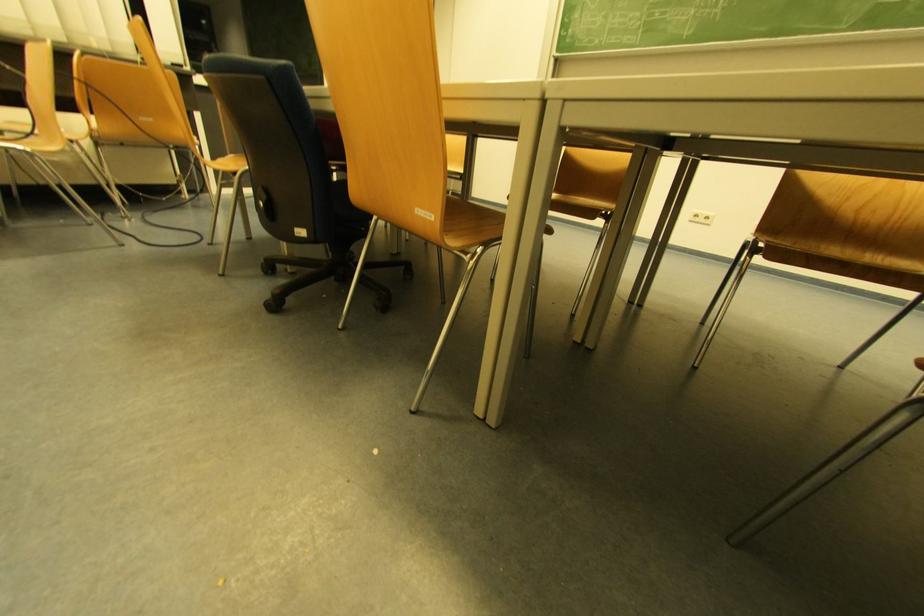
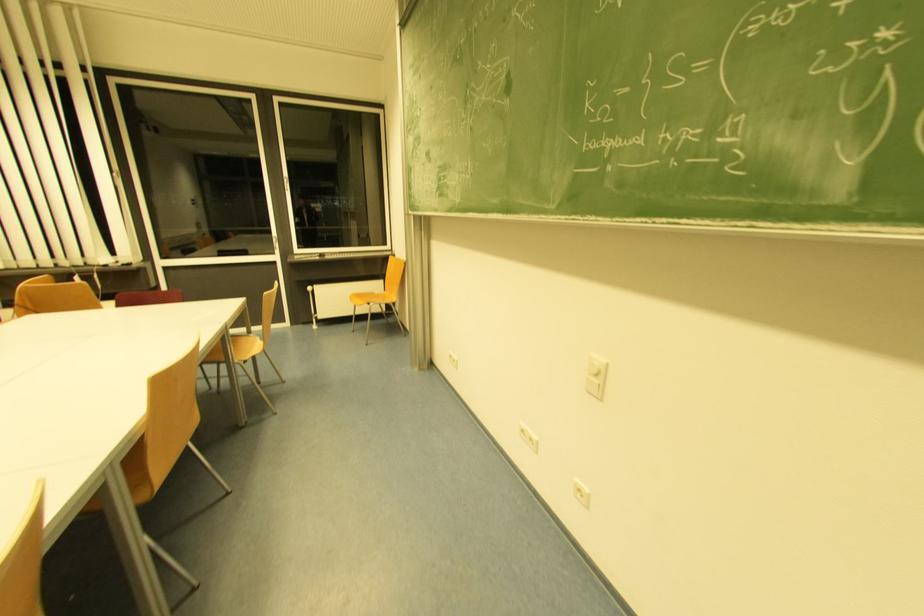
The images are taken continuously from a first-person perspective. In which direction are you moving?

The movement direction of the cameraman is right, forward.